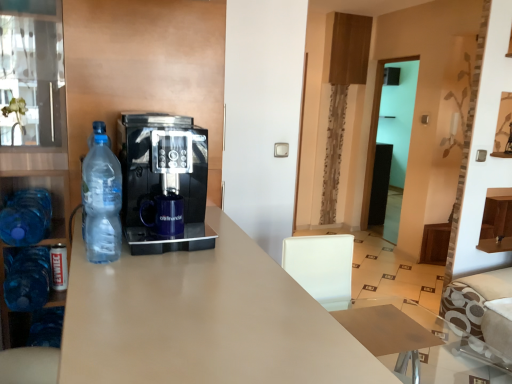
Question: Does point (97, 147) appear closer or farther from the camera than point (252, 291)?

Choices:
 (A) farther
 (B) closer

Answer: (A)

Question: Looking at the image, does clear plastic bottle at left, marked as the third bottle in a left-to-right arrangement, seem bigger or smaller compared to matte beige desk at center?

Choices:
 (A) small
 (B) big

Answer: (A)

Question: Estimate the real-world distances between objects in this image. Which object is closer to the blue plastic bottle at left, placed as the 2th bottle when sorted from back to front?

Choices:
 (A) clear plastic bottle at left, marked as the first bottle in a front-to-back arrangement
 (B) matte beige desk at center
 (C) transparent glass door at center
 (D) blue plastic bottle at lower left, which is the third bottle in front-to-back order
 (E) blue glass cabinet at left

Answer: (D)

Question: Estimate the real-world distances between objects in this image. Which object is farther from the blue glass cabinet at left?

Choices:
 (A) transparent glass door at center
 (B) clear plastic bottle at left, which is the third bottle in back-to-front order
 (C) matte beige desk at center
 (D) blue plastic bottle at left, which is the second bottle from bottom to top
 (E) transparent glass table at lower right

Answer: (A)